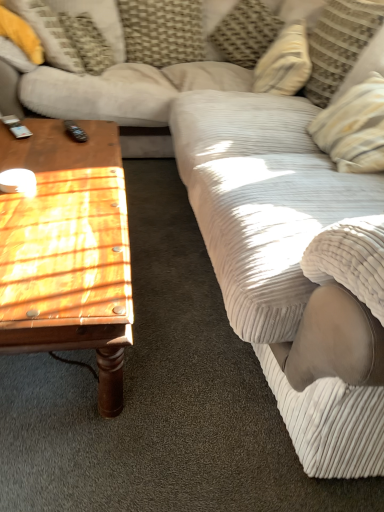
Question: Is wooden polished coffee table at left taller than striped fabric pillow at upper right, the fourth pillow from the left?

Choices:
 (A) yes
 (B) no

Answer: (B)

Question: Does wooden polished coffee table at left appear on the right side of striped fabric pillow at upper right, the fourth pillow from the left?

Choices:
 (A) yes
 (B) no

Answer: (B)

Question: From a real-world perspective, is wooden polished coffee table at left under striped fabric pillow at upper right, arranged as the first pillow when viewed from the right?

Choices:
 (A) yes
 (B) no

Answer: (A)

Question: From the image's perspective, does wooden polished coffee table at left appear higher than striped fabric pillow at upper right, the fourth pillow from the left?

Choices:
 (A) no
 (B) yes

Answer: (A)

Question: Does wooden polished coffee table at left come behind striped fabric pillow at upper right, arranged as the first pillow when viewed from the right?

Choices:
 (A) no
 (B) yes

Answer: (A)

Question: Considering the positions of striped fabric pillow at upper right, the fourth pillow from the left, and woven fabric pillow at upper center, the third pillow positioned from the right, in the image, is striped fabric pillow at upper right, the fourth pillow from the left, taller or shorter than woven fabric pillow at upper center, the third pillow positioned from the right,?

Choices:
 (A) short
 (B) tall

Answer: (B)

Question: From the image's perspective, is striped fabric pillow at upper right, the fourth pillow from the left, located above or below woven fabric pillow at upper center, the third pillow positioned from the right?

Choices:
 (A) below
 (B) above

Answer: (A)

Question: From a real-world perspective, is striped fabric pillow at upper right, the fourth pillow from the left, above or below woven fabric pillow at upper center, the third pillow positioned from the right?

Choices:
 (A) above
 (B) below

Answer: (A)

Question: Considering their positions, is striped fabric pillow at upper right, arranged as the first pillow when viewed from the right, located in front of or behind woven fabric pillow at upper center, positioned as the 2th pillow in left-to-right order?

Choices:
 (A) front
 (B) behind

Answer: (A)

Question: In the image, is black plastic remote at left positioned in front of or behind wooden polished coffee table at left?

Choices:
 (A) front
 (B) behind

Answer: (B)

Question: Is point (77, 135) closer or farther from the camera than point (11, 310)?

Choices:
 (A) farther
 (B) closer

Answer: (A)

Question: Considering the positions of black plastic remote at left and wooden polished coffee table at left in the image, is black plastic remote at left taller or shorter than wooden polished coffee table at left?

Choices:
 (A) tall
 (B) short

Answer: (B)

Question: From the image's perspective, is black plastic remote at left located above or below wooden polished coffee table at left?

Choices:
 (A) below
 (B) above

Answer: (B)

Question: Based on their positions, is wooden polished coffee table at left located to the left or right of yellow fabric pillow at upper left, which is counted as the fourth pillow, starting from the right?

Choices:
 (A) right
 (B) left

Answer: (A)

Question: From the image's perspective, is wooden polished coffee table at left above or below yellow fabric pillow at upper left, the first pillow when ordered from left to right?

Choices:
 (A) below
 (B) above

Answer: (A)